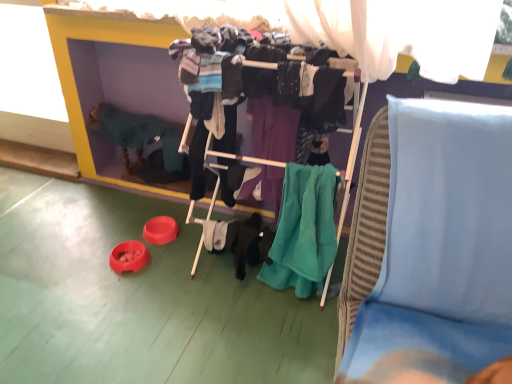
Question: Can you confirm if light blue fabric at upper right is bigger than teal fabric clothes at center?

Choices:
 (A) yes
 (B) no

Answer: (A)

Question: Is light blue fabric at upper right at the right side of teal fabric clothes at center?

Choices:
 (A) yes
 (B) no

Answer: (A)

Question: Are light blue fabric at upper right and teal fabric clothes at center located far from each other?

Choices:
 (A) yes
 (B) no

Answer: (B)

Question: Does light blue fabric at upper right appear on the left side of teal fabric clothes at center?

Choices:
 (A) no
 (B) yes

Answer: (A)

Question: Is light blue fabric at upper right oriented towards teal fabric clothes at center?

Choices:
 (A) no
 (B) yes

Answer: (A)

Question: From a real-world perspective, is light blue fabric at upper right positioned under teal fabric clothes at center based on gravity?

Choices:
 (A) yes
 (B) no

Answer: (A)

Question: From the image's perspective, is teal soft towel at center above knitted green sweater at left?

Choices:
 (A) no
 (B) yes

Answer: (A)

Question: From the image's perspective, is teal soft towel at center beneath knitted green sweater at left?

Choices:
 (A) no
 (B) yes

Answer: (B)

Question: Is knitted green sweater at left inside teal soft towel at center?

Choices:
 (A) no
 (B) yes

Answer: (A)

Question: Does teal soft towel at center appear on the left side of knitted green sweater at left?

Choices:
 (A) no
 (B) yes

Answer: (A)

Question: Does teal soft towel at center come behind knitted green sweater at left?

Choices:
 (A) no
 (B) yes

Answer: (A)

Question: Is teal soft towel at center facing towards knitted green sweater at left?

Choices:
 (A) yes
 (B) no

Answer: (B)

Question: Can you confirm if light blue fabric at upper right is wider than knitted green sweater at left?

Choices:
 (A) yes
 (B) no

Answer: (A)